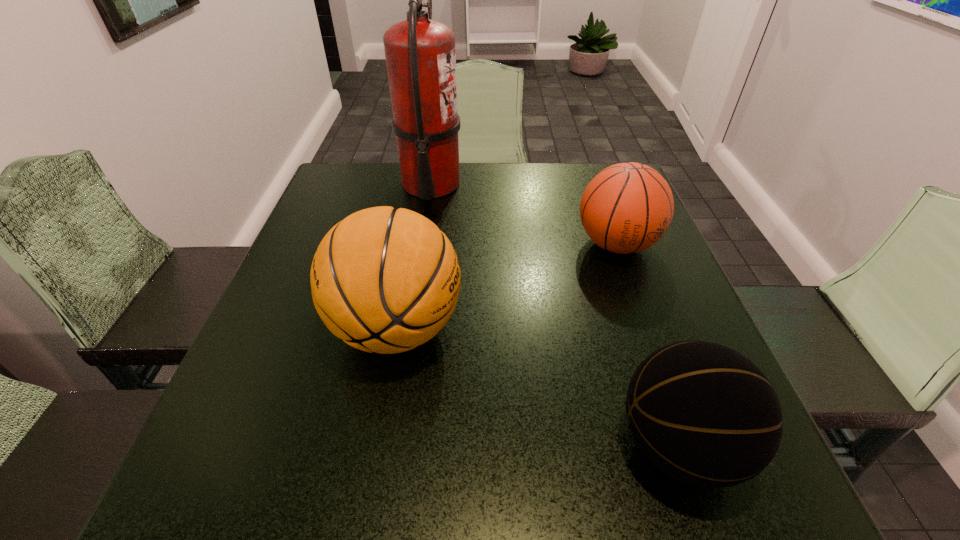
The width and height of the screenshot is (960, 540). In order to click on the farthest object in this screenshot , I will do `click(420, 56)`.

Identify the location of the tallest object. Image resolution: width=960 pixels, height=540 pixels. (420, 56).

At what (x,y) coordinates should I click in order to perform the action: click on the second tallest object. Please return your answer as a coordinate pair (x, y). The width and height of the screenshot is (960, 540). Looking at the image, I should click on (384, 280).

The height and width of the screenshot is (540, 960). What are the coordinates of `the tallest basketball` in the screenshot? It's located at (384, 280).

Find the location of `the second farthest object`. the second farthest object is located at coordinates (626, 208).

Locate an element on the screen. The width and height of the screenshot is (960, 540). the nearest basketball is located at coordinates (703, 413).

The height and width of the screenshot is (540, 960). I want to click on vacant point located 0.350m toward the nozzle of the fire extinguisher, so click(x=588, y=184).

Image resolution: width=960 pixels, height=540 pixels. I want to click on vacant area situated on the surface of the second nearest basketball near the brand logo, so click(x=536, y=328).

This screenshot has width=960, height=540. I want to click on free location located on the front of the third nearest object, so click(651, 341).

Locate an element on the screen. This screenshot has height=540, width=960. free location located on the left of the nearest object is located at coordinates (446, 444).